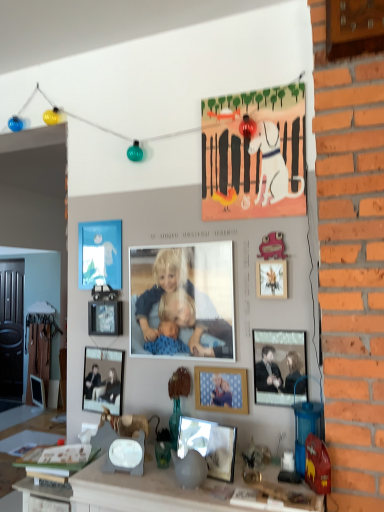
The image size is (384, 512). Describe the element at coordinates (271, 279) in the screenshot. I see `pink matte picture frame at upper right, which appears as the 3th picture frame when viewed from the front` at that location.

Where is `wooden photo frame at center, the sixth picture frame from the left`? The height and width of the screenshot is (512, 384). wooden photo frame at center, the sixth picture frame from the left is located at coordinates (221, 389).

What do you see at coordinates (278, 365) in the screenshot?
I see `matte black picture frame at center-right, the 7th picture frame when ordered from back to front` at bounding box center [278, 365].

The image size is (384, 512). I want to click on matte paper dog at upper center, so click(254, 154).

What do you see at coordinates (105, 318) in the screenshot? I see `metallic silver picture frame at center-left, which is counted as the 5th picture frame, starting from the front` at bounding box center [105, 318].

In order to click on metallic silver picture frame at center-left, which is counted as the 5th picture frame, starting from the front in this screenshot , I will do `click(105, 318)`.

Where is `blue matte picture frame at upper left, the 2th picture frame viewed from the left`? The image size is (384, 512). blue matte picture frame at upper left, the 2th picture frame viewed from the left is located at coordinates (100, 254).

Locate an element on the screen. The height and width of the screenshot is (512, 384). pink matte picture frame at upper right, acting as the 2th picture frame starting from the right is located at coordinates (271, 279).

Is smooth skin baby at center in front of or behind matte black picture frame at center-right, acting as the 1th picture frame starting from the right, in the image?

smooth skin baby at center is positioned farther from the viewer than matte black picture frame at center-right, acting as the 1th picture frame starting from the right.

From the picture: Considering the relative sizes of smooth skin baby at center and matte black picture frame at center-right, arranged as the eighth picture frame when viewed from the left, in the image provided, is smooth skin baby at center bigger than matte black picture frame at center-right, arranged as the eighth picture frame when viewed from the left,?

Yes, smooth skin baby at center is bigger than matte black picture frame at center-right, arranged as the eighth picture frame when viewed from the left.

Would you say smooth skin baby at center is outside matte black picture frame at center-right, the 7th picture frame when ordered from back to front?

That's correct, smooth skin baby at center is outside of matte black picture frame at center-right, the 7th picture frame when ordered from back to front.

Which of these two, blue matte picture frame at upper left, the second picture frame in the back-to-front sequence, or smooth gray stone counter at center, is wider?

smooth gray stone counter at center is wider.

Is blue matte picture frame at upper left, which ranks as the seventh picture frame in right-to-left order, behind smooth gray stone counter at center?

Yes, blue matte picture frame at upper left, which ranks as the seventh picture frame in right-to-left order, is further from the camera.

Looking at this image, who is bigger, blue matte picture frame at upper left, which ranks as the 8th picture frame in bottom-to-top order, or smooth gray stone counter at center?

With larger size is smooth gray stone counter at center.

From a real-world perspective, who is located lower, blue matte picture frame at upper left, placed as the first picture frame when sorted from top to bottom, or smooth gray stone counter at center?

smooth gray stone counter at center.

Is metallic silver picture frame at center-left, which is the 3th picture frame from top to bottom, placed right next to blue matte picture frame at upper left, the 2th picture frame viewed from the left?

No, metallic silver picture frame at center-left, which is the 3th picture frame from top to bottom, is not beside blue matte picture frame at upper left, the 2th picture frame viewed from the left.

Locate an element on the screen. The height and width of the screenshot is (512, 384). the 2nd picture frame below the blue matte picture frame at upper left, which ranks as the 8th picture frame in bottom-to-top order (from the image's perspective) is located at coordinates (105, 318).

Considering the sizes of metallic silver picture frame at center-left, marked as the sixth picture frame in a bottom-to-top arrangement, and blue matte picture frame at upper left, which ranks as the 8th picture frame in bottom-to-top order, in the image, is metallic silver picture frame at center-left, marked as the sixth picture frame in a bottom-to-top arrangement, taller or shorter than blue matte picture frame at upper left, which ranks as the 8th picture frame in bottom-to-top order,?

metallic silver picture frame at center-left, marked as the sixth picture frame in a bottom-to-top arrangement, is shorter than blue matte picture frame at upper left, which ranks as the 8th picture frame in bottom-to-top order.

Is metallic silver picture frame at center-left, which is the 3th picture frame from top to bottom, situated inside blue matte picture frame at upper left, placed as the first picture frame when sorted from top to bottom, or outside?

metallic silver picture frame at center-left, which is the 3th picture frame from top to bottom, is not inside blue matte picture frame at upper left, placed as the first picture frame when sorted from top to bottom, it's outside.

Is metallic silver picture frame at center-left, marked as the sixth picture frame in a bottom-to-top arrangement, bigger than matte black picture frame at left, the 1th picture frame ordered from the bottom?

Incorrect, metallic silver picture frame at center-left, marked as the sixth picture frame in a bottom-to-top arrangement, is not larger than matte black picture frame at left, the 1th picture frame ordered from the bottom.

Which point is more distant from viewer, (x=121, y=310) or (x=35, y=383)?

The point (x=35, y=383) is farther from the camera.

Based on the photo, from the image's perspective, which object appears higher, metallic silver picture frame at center-left, marked as the sixth picture frame in a bottom-to-top arrangement, or matte black picture frame at left, the 1th picture frame ordered from the bottom?

metallic silver picture frame at center-left, marked as the sixth picture frame in a bottom-to-top arrangement.

Is metallic silver picture frame at center-left, marked as the 4th picture frame in a left-to-right arrangement, shorter than matte black picture frame at left, positioned as the 8th picture frame in top-to-bottom order?

Correct, metallic silver picture frame at center-left, marked as the 4th picture frame in a left-to-right arrangement, is not as tall as matte black picture frame at left, positioned as the 8th picture frame in top-to-bottom order.

Which is closer to the camera, (262, 288) or (223, 377)?

Point (262, 288).

Does pink matte picture frame at upper right, acting as the 2th picture frame starting from the right, have a larger size compared to wooden photo frame at center, the fourth picture frame in the front-to-back sequence?

Indeed, pink matte picture frame at upper right, acting as the 2th picture frame starting from the right, has a larger size compared to wooden photo frame at center, the fourth picture frame in the front-to-back sequence.

Is pink matte picture frame at upper right, positioned as the seventh picture frame in bottom-to-top order, in front of wooden photo frame at center, the fourth picture frame ordered from the bottom?

Yes, the depth of pink matte picture frame at upper right, positioned as the seventh picture frame in bottom-to-top order, is less than that of wooden photo frame at center, the fourth picture frame ordered from the bottom.

Is matte black picture frame at center-right, the 7th picture frame when ordered from back to front, facing towards metallic reflective frame at center, the fourth picture frame from the right?

No, matte black picture frame at center-right, the 7th picture frame when ordered from back to front, is not turned towards metallic reflective frame at center, the fourth picture frame from the right.

Which is closer to the camera, (291, 362) or (223, 476)?

The point (223, 476) is more forward.

Which object is closer to the camera taking this photo, matte black picture frame at center-right, the second picture frame when ordered from front to back, or metallic reflective frame at center, placed as the first picture frame when sorted from front to back?

metallic reflective frame at center, placed as the first picture frame when sorted from front to back, is closer to the camera.

Which is more to the right, matte black picture frame at center-right, arranged as the eighth picture frame when viewed from the left, or metallic reflective frame at center, positioned as the eighth picture frame in back-to-front order?

Positioned to the right is matte black picture frame at center-right, arranged as the eighth picture frame when viewed from the left.

Which is more to the right, metallic reflective frame at center, which is counted as the fifth picture frame, starting from the left, or smooth skin baby at center?

From the viewer's perspective, metallic reflective frame at center, which is counted as the fifth picture frame, starting from the left, appears more on the right side.

Could you tell me if metallic reflective frame at center, the fourth picture frame from the right, is turned towards smooth skin baby at center?

No.

Is metallic reflective frame at center, placed as the 7th picture frame when sorted from top to bottom, wider than smooth skin baby at center?

Indeed, metallic reflective frame at center, placed as the 7th picture frame when sorted from top to bottom, has a greater width compared to smooth skin baby at center.

From the image's perspective, which object appears higher, metallic reflective frame at center, acting as the second picture frame starting from the bottom, or smooth skin baby at center?

From the image's view, smooth skin baby at center is above.

What are the coordinates of `picture frame that is the 4th one when counting rightward from the smooth skin baby at center` in the screenshot? It's located at (278, 365).

This screenshot has height=512, width=384. Identify the location of picture frame that is the 7th object located above the smooth gray stone counter at center (from the image's perspective). (100, 254).

Looking at the image, which one is located closer to blue matte picture frame at upper left, which ranks as the 8th picture frame in bottom-to-top order, matte black picture frame at center-right, positioned as the fourth picture frame in top-to-bottom order, or red plastic toy at lower right?

Based on the image, matte black picture frame at center-right, positioned as the fourth picture frame in top-to-bottom order, appears to be nearer to blue matte picture frame at upper left, which ranks as the 8th picture frame in bottom-to-top order.

Which object lies nearer to the anchor point smooth gray stone counter at center, blue matte picture frame at upper left, placed as the first picture frame when sorted from top to bottom, or matte black picture frame at center-right, arranged as the eighth picture frame when viewed from the left?

Among the two, matte black picture frame at center-right, arranged as the eighth picture frame when viewed from the left, is located nearer to smooth gray stone counter at center.

From the picture: When comparing their distances from metallic silver picture frame at center-left, marked as the sixth picture frame in a bottom-to-top arrangement, does smooth gray stone counter at center or red plastic toy at lower right seem further?

red plastic toy at lower right is positioned further to the anchor metallic silver picture frame at center-left, marked as the sixth picture frame in a bottom-to-top arrangement.

Looking at the image, which one is located further to metallic reflective frame at center, the fourth picture frame from the right, blue matte picture frame at upper left, which is the seventh picture frame in front-to-back order, or metallic silver picture frame at center-left, marked as the 4th picture frame in a left-to-right arrangement?

blue matte picture frame at upper left, which is the seventh picture frame in front-to-back order, is positioned further to the anchor metallic reflective frame at center, the fourth picture frame from the right.

Which object lies nearer to the anchor point pink matte picture frame at upper right, which appears as the 3th picture frame when viewed from the front, wooden photo frame at center, positioned as the 3th picture frame in right-to-left order, or metallic silver picture frame at center-left, marked as the sixth picture frame in a bottom-to-top arrangement?

Among the two, wooden photo frame at center, positioned as the 3th picture frame in right-to-left order, is located nearer to pink matte picture frame at upper right, which appears as the 3th picture frame when viewed from the front.

When comparing their distances from matte black picture frame at center-right, positioned as the fourth picture frame in top-to-bottom order, does smooth gray stone counter at center or smooth skin baby at center seem closer?

smooth skin baby at center is closer to matte black picture frame at center-right, positioned as the fourth picture frame in top-to-bottom order.

Considering their positions, is metallic reflective frame at center, placed as the 7th picture frame when sorted from top to bottom, positioned closer to metallic silver picture frame at center-left, the fourth picture frame positioned from the back, than red plastic toy at lower right?

Among the two, metallic reflective frame at center, placed as the 7th picture frame when sorted from top to bottom, is located nearer to metallic silver picture frame at center-left, the fourth picture frame positioned from the back.

From the picture: Which object lies nearer to the anchor point metallic reflective frame at center, positioned as the eighth picture frame in back-to-front order, matte black picture frame at left, the 1th picture frame ordered from the bottom, or matte black picture frame at center, positioned as the third picture frame in back-to-front order?

Based on the image, matte black picture frame at center, positioned as the third picture frame in back-to-front order, appears to be nearer to metallic reflective frame at center, positioned as the eighth picture frame in back-to-front order.

Find the location of a particular element. picture frame between matte black picture frame at center, positioned as the 3th picture frame in bottom-to-top order, and matte black picture frame at left, the 1th picture frame ordered from the bottom, from front to back is located at coordinates (100, 254).

Identify the location of person between matte paper dog at upper center and red plastic toy at lower right vertically. (171, 296).

The height and width of the screenshot is (512, 384). What are the coordinates of `toy between matte black picture frame at center-right, which is counted as the fifth picture frame, starting from the bottom, and smooth gray stone counter at center vertically` in the screenshot? It's located at (317, 465).

This screenshot has height=512, width=384. What are the coordinates of `person between matte paper dog at upper center and matte black picture frame at center-right, which is counted as the fifth picture frame, starting from the bottom, from top to bottom` in the screenshot? It's located at (171, 296).